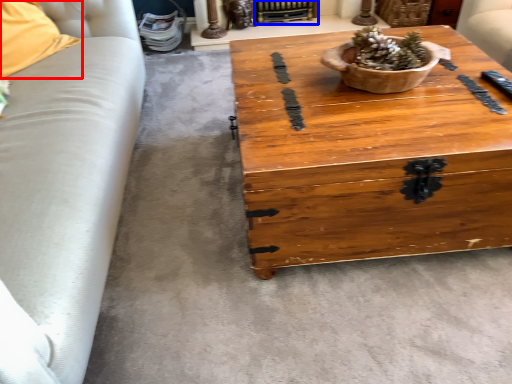
Question: Which object is closer to the camera taking this photo, pillow (highlighted by a red box) or fireplace (highlighted by a blue box)?

Choices:
 (A) pillow
 (B) fireplace

Answer: (A)